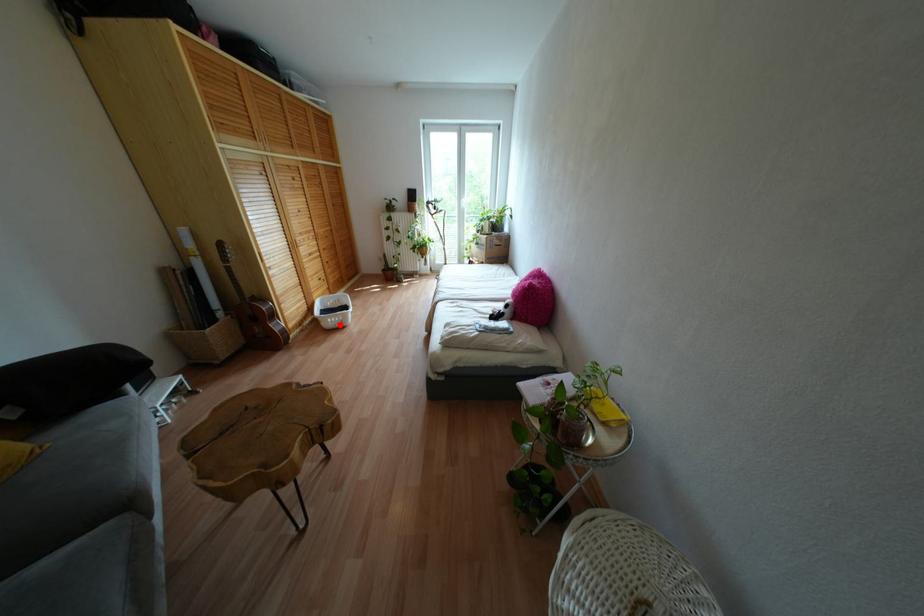
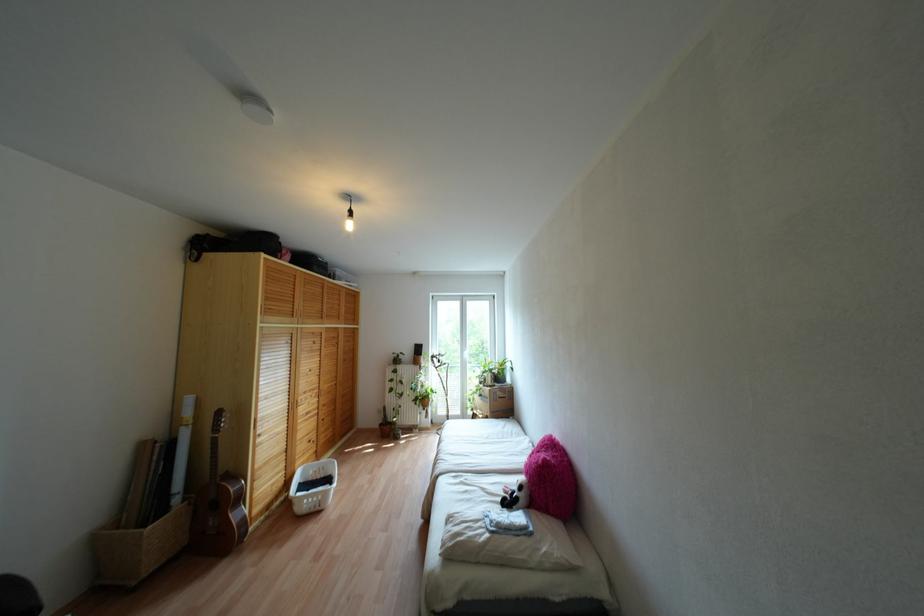
Question: I am providing you with two images of the same scene from different viewpoints. A red point is shown in image1. For the corresponding object point in image2, is it positioned nearer or farther from the camera?

Choices:
 (A) Nearer
 (B) Farther

Answer: (B)